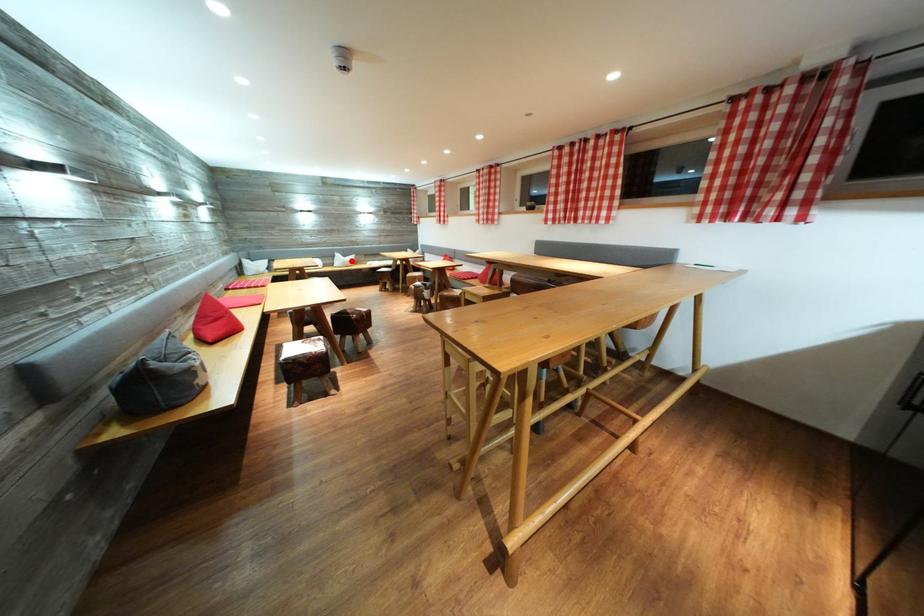
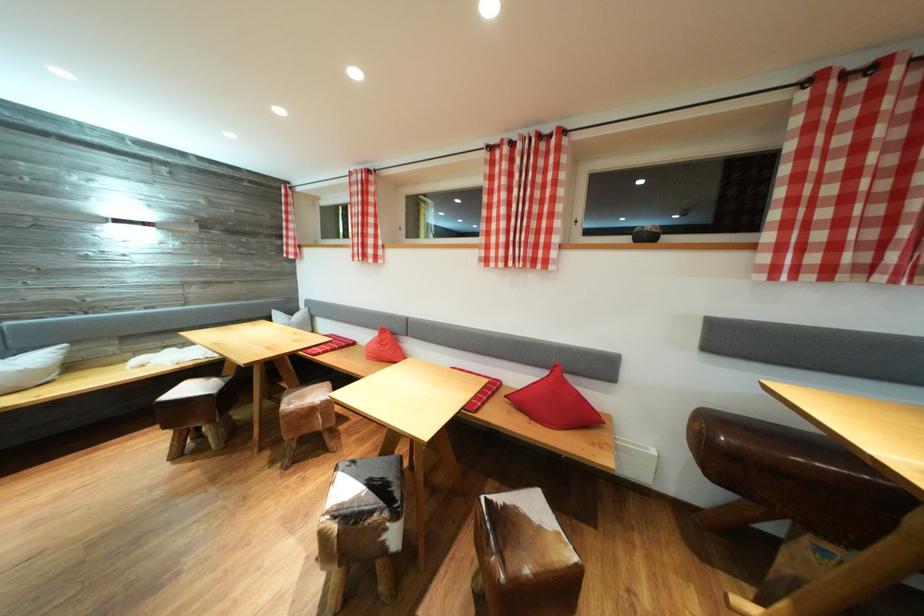
Question: I am providing you with two images of the same scene from different viewpoints. Image1 has a red point marked. In image2, the corresponding 3D location appears at what relative position? Reply with the corresponding letter.

Choices:
 (A) Closer
 (B) Farther

Answer: (B)